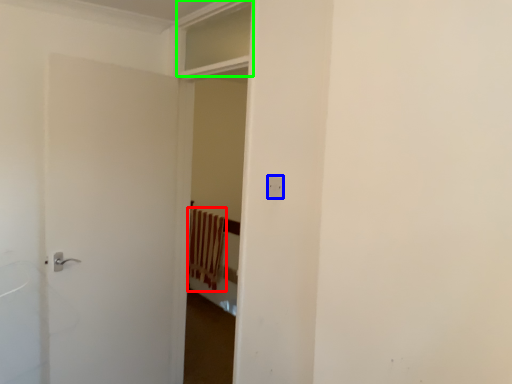
Question: Which object is positioned closest to curtain (highlighted by a red box)? Select from electric outlet (highlighted by a blue box) and window (highlighted by a green box).

Choices:
 (A) electric outlet
 (B) window

Answer: (B)